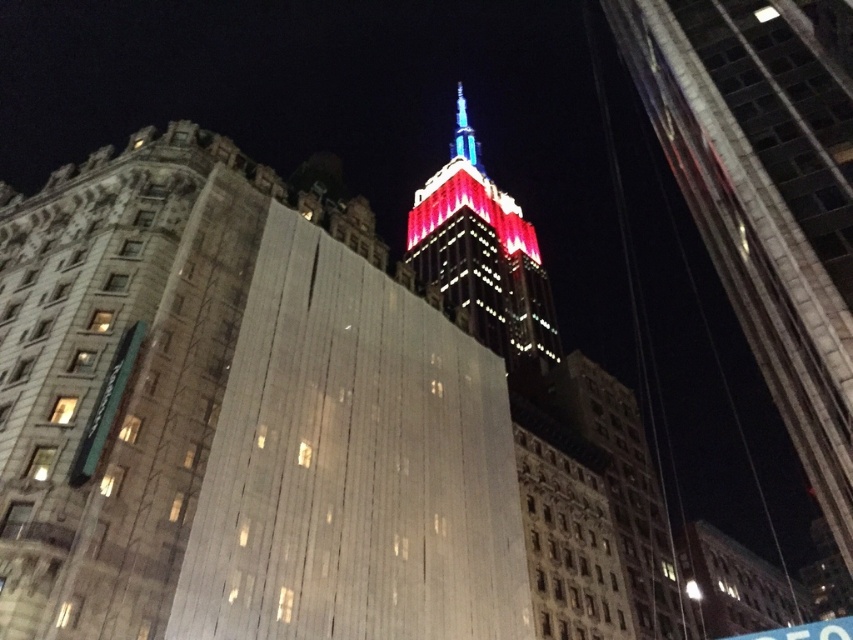
Question: Which object is positioned farthest from the smooth concrete skyscraper at right?

Choices:
 (A) red glass tower at center
 (B) shiny blue spire at center
 (C) green plastic sign at lower left

Answer: (B)

Question: Which point is farther to the camera?

Choices:
 (A) (801, 394)
 (B) (91, 422)

Answer: (A)

Question: Is red glass tower at center further to camera compared to green plastic sign at lower left?

Choices:
 (A) yes
 (B) no

Answer: (A)

Question: Can you confirm if smooth concrete skyscraper at right is wider than red glass tower at center?

Choices:
 (A) yes
 (B) no

Answer: (B)

Question: Among these objects, which one is farthest from the camera?

Choices:
 (A) smooth concrete skyscraper at right
 (B) red glass tower at center

Answer: (B)

Question: Is red glass tower at center bigger than shiny blue spire at center?

Choices:
 (A) yes
 (B) no

Answer: (A)